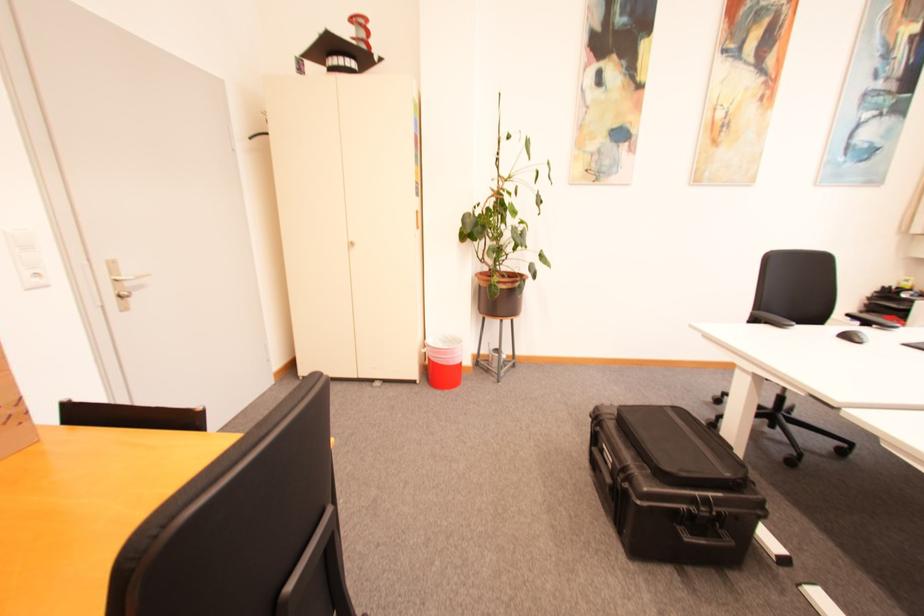
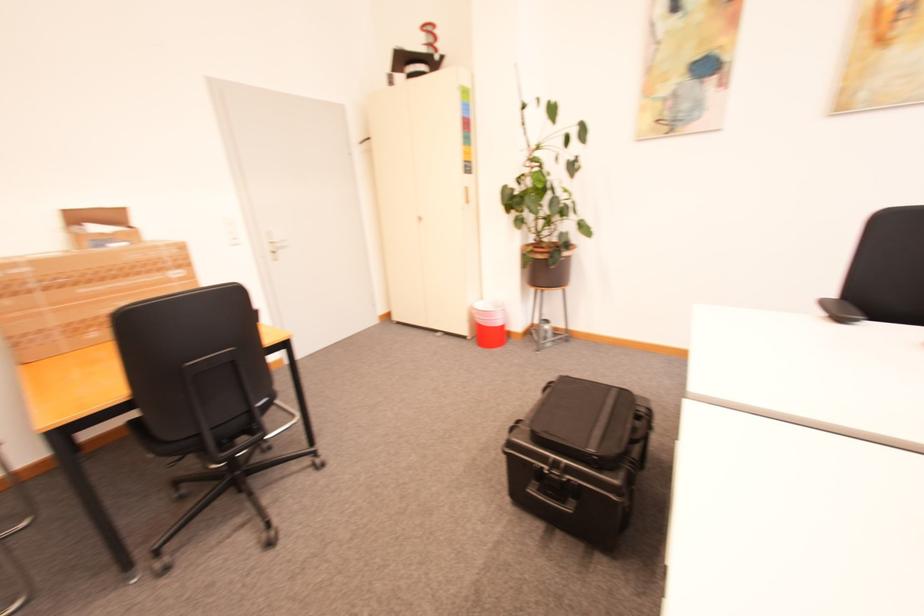
Find the pixel in the second image that matches point (123, 282) in the first image.

(277, 244)